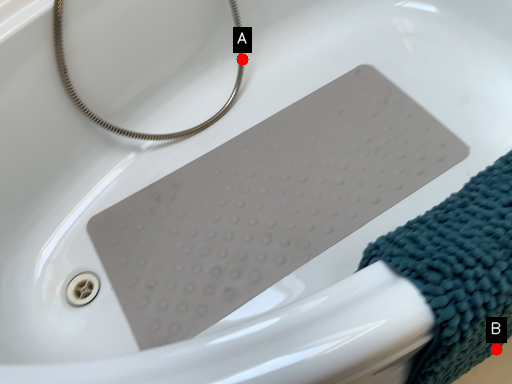
Question: Two points are circled on the image, labeled by A and B beside each circle. Which point is further to the camera?

Choices:
 (A) A is further
 (B) B is further

Answer: (A)